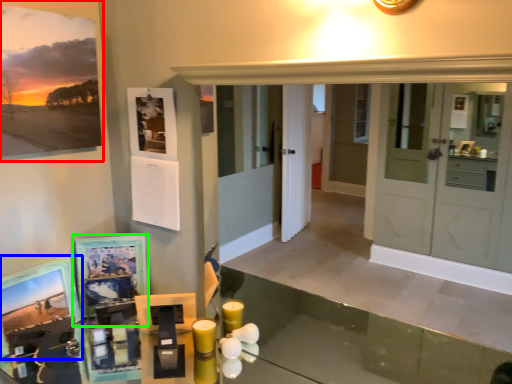
Question: Considering the real-world distances, which object is closest to picture frame (highlighted by a red box)? picture frame (highlighted by a blue box) or picture frame (highlighted by a green box).

Choices:
 (A) picture frame
 (B) picture frame

Answer: (B)